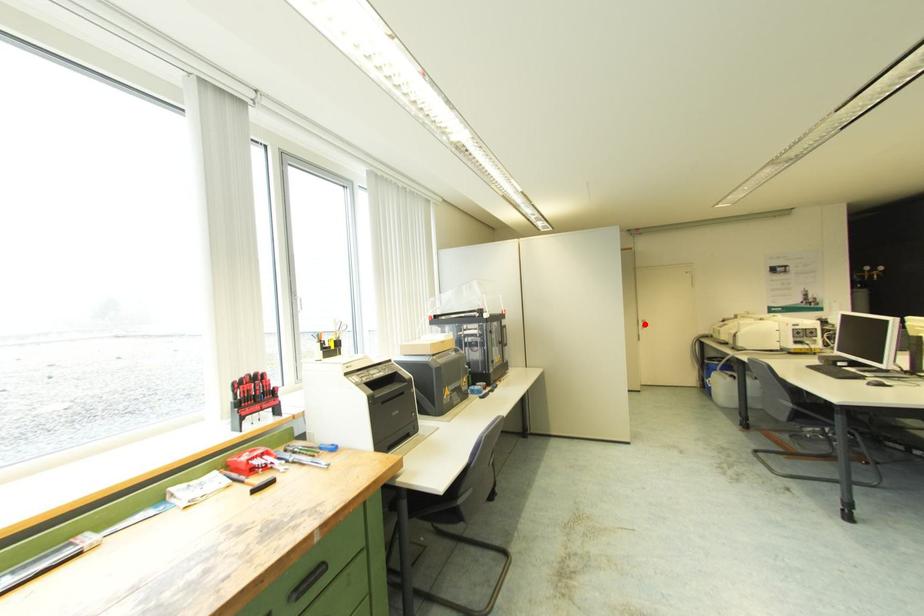
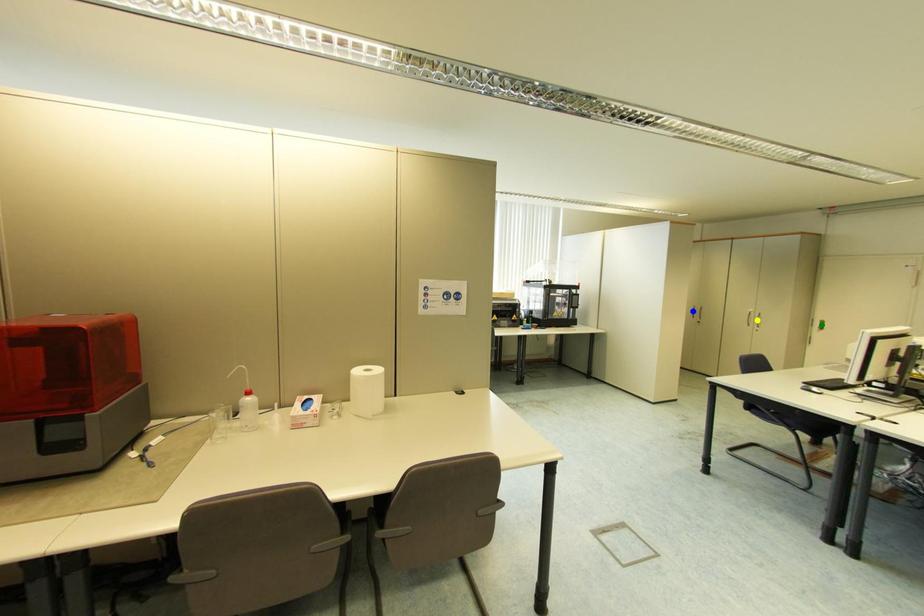
Question: I am providing you with two images of the same scene from different viewpoints. A red point is marked on the first image. You are given multiple points on the second image. Which point in image 2 is actually the same real-world point as the red point in image 1?

Choices:
 (A) yellow point
 (B) green point
 (C) blue point

Answer: (B)